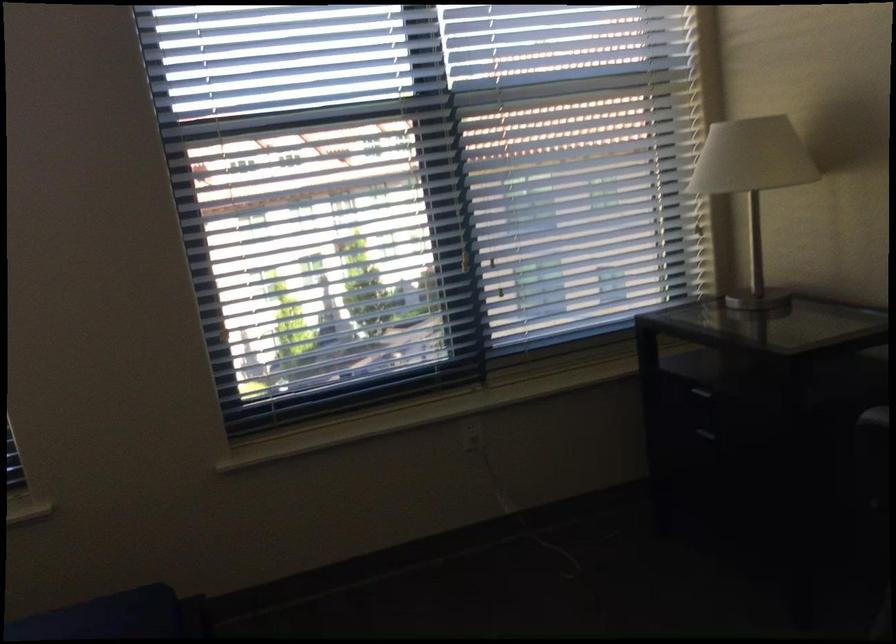
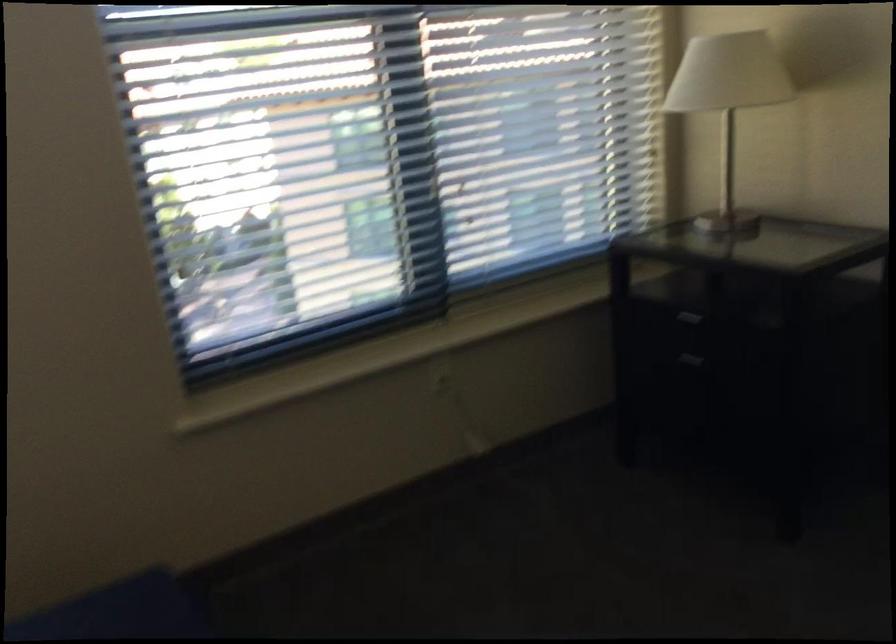
Where in the second image is the point corresponding to pixel 702 440 from the first image?

(685, 366)